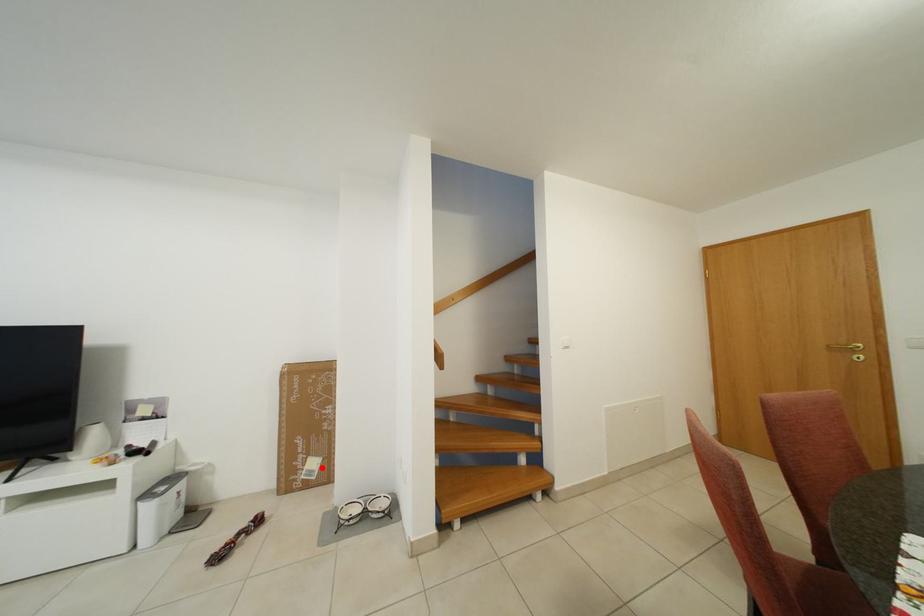
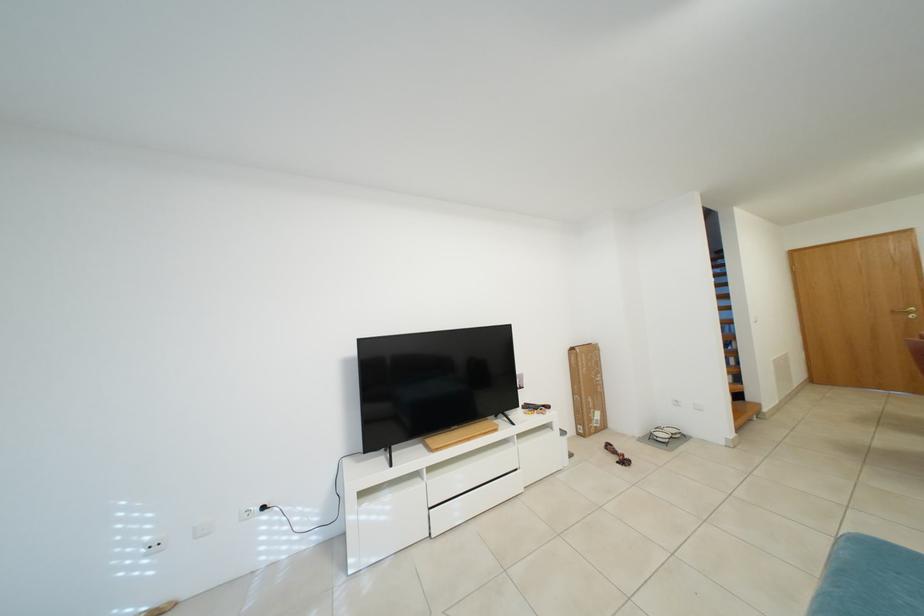
Find the pixel in the second image that matches the highlighted location in the first image.

(605, 419)